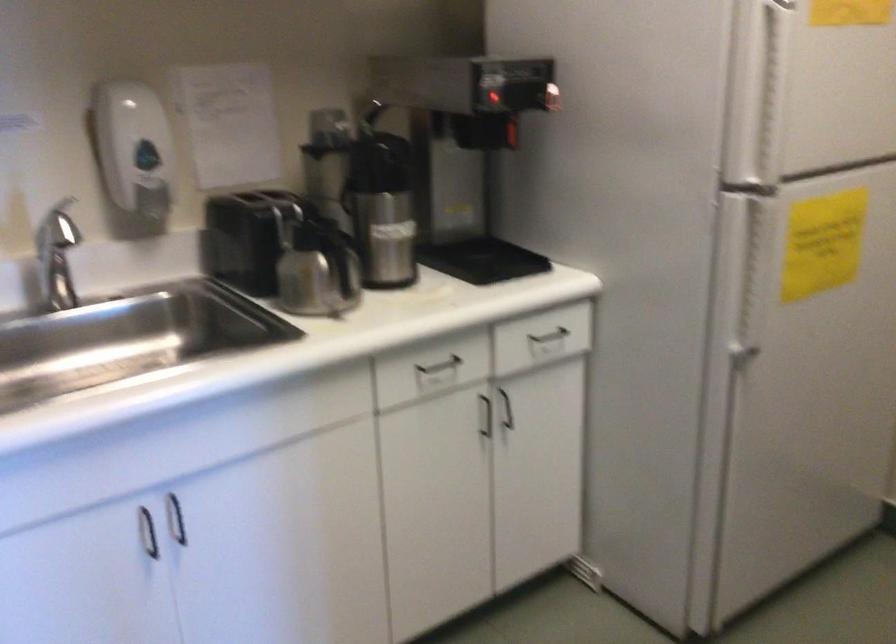
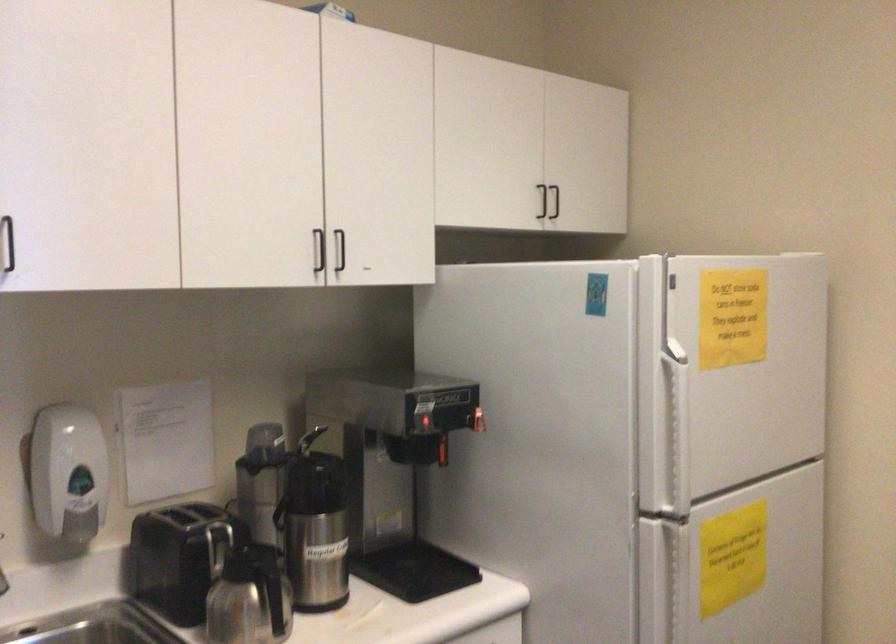
Find the pixel in the second image that matches point 773,90 in the first image.

(675, 431)